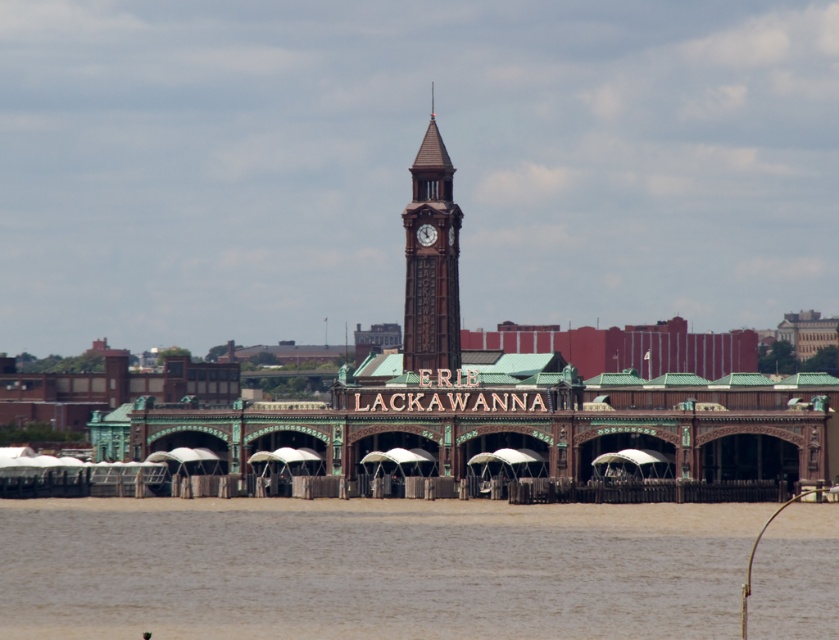
Question: Is brown wooden clock tower at center to the left of wooden clock at center from the viewer's perspective?

Choices:
 (A) no
 (B) yes

Answer: (B)

Question: Can you confirm if brown sedimentary water at lower center is positioned above brown wooden clock tower at center?

Choices:
 (A) no
 (B) yes

Answer: (A)

Question: Among these points, which one is nearest to the camera?

Choices:
 (A) (274, 516)
 (B) (435, 330)

Answer: (A)

Question: Which point appears farthest from the camera in this image?

Choices:
 (A) [428, 230]
 (B) [433, 99]
 (C) [675, 509]

Answer: (B)

Question: Estimate the real-world distances between objects in this image. Which object is closer to the wooden clock at center?

Choices:
 (A) brown sedimentary water at lower center
 (B) brown wooden clock tower at center

Answer: (B)

Question: Is brown sedimentary water at lower center further to the viewer compared to wooden clock at center?

Choices:
 (A) yes
 (B) no

Answer: (B)